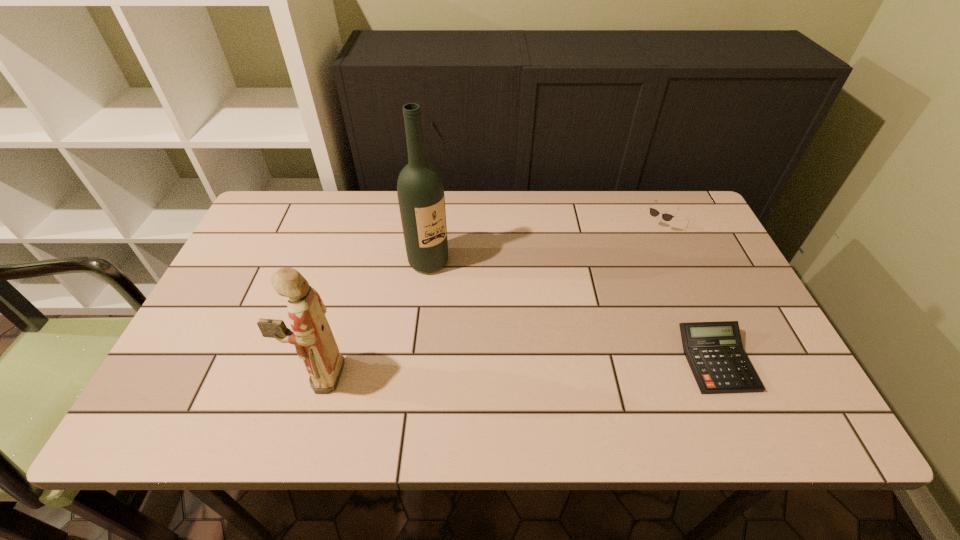
This screenshot has height=540, width=960. Identify the location of calculator at the right edge. (714, 351).

Identify the location of sunglasses present at the right edge. This screenshot has width=960, height=540. (666, 217).

The image size is (960, 540). What are the coordinates of `object present at the far right corner` in the screenshot? It's located at (666, 217).

At what (x,y) coordinates should I click in order to perform the action: click on object that is positioned at the near right corner. Please return your answer as a coordinate pair (x, y). The width and height of the screenshot is (960, 540). Looking at the image, I should click on (714, 351).

You are a GUI agent. You are given a task and a screenshot of the screen. Output one action in this format:
    pyautogui.click(x=<x>, y=<y>)
    Task: Click on the vacant space at the far edge of the desktop
    The width and height of the screenshot is (960, 540).
    Given the screenshot: What is the action you would take?
    622,240

What are the coordinates of `vacant space at the near edge` in the screenshot? It's located at (399, 375).

Find the location of a particular element. The width and height of the screenshot is (960, 540). vacant space at the left edge of the desktop is located at coordinates (243, 271).

Locate an element on the screen. The height and width of the screenshot is (540, 960). vacant area at the right edge is located at coordinates (720, 289).

The width and height of the screenshot is (960, 540). In the image, there is a desktop. In order to click on blank space at the far left corner in this screenshot , I will do `click(287, 202)`.

Find the location of `vacant space at the far right corner of the desktop`. vacant space at the far right corner of the desktop is located at coordinates (670, 233).